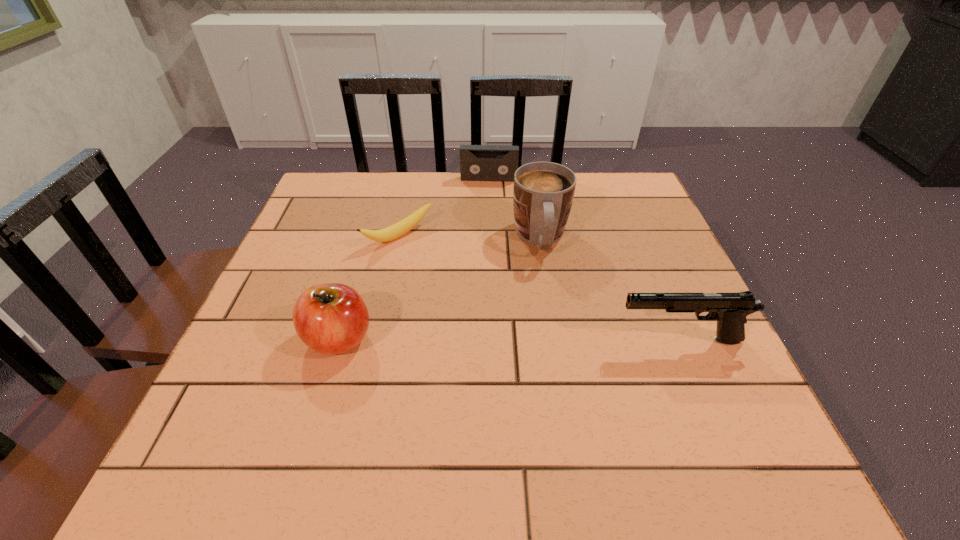
At what (x,y) coordinates should I click in order to perform the action: click on vacant space positioned 0.330m on the upward curve of the shortest object. Please return your answer as a coordinate pair (x, y). Image resolution: width=960 pixels, height=540 pixels. Looking at the image, I should click on (511, 329).

This screenshot has height=540, width=960. Identify the location of vacant space located on the upward curve of the shortest object. (449, 277).

What are the coordinates of `vacant space located on the upward curve of the shortest object` in the screenshot? It's located at (437, 266).

Identify the location of free spot located on the front-facing side of the farthest object. The height and width of the screenshot is (540, 960). (485, 237).

Find the location of a particular element. free space located on the front-facing side of the farthest object is located at coordinates (488, 191).

You are a GUI agent. You are given a task and a screenshot of the screen. Output one action in this format:
    pyautogui.click(x=<x>, y=<y>)
    Task: Click on the free space located 0.400m on the front-facing side of the farthest object
    Image resolution: width=960 pixels, height=540 pixels.
    Given the screenshot: What is the action you would take?
    pyautogui.click(x=483, y=274)

I want to click on free location located 0.180m on the side of the mug with the handle, so click(553, 326).

Where is `vacant space located on the side of the mug with the handle`? Image resolution: width=960 pixels, height=540 pixels. vacant space located on the side of the mug with the handle is located at coordinates (562, 390).

Where is `free spot located on the side of the mug with the handle`? Image resolution: width=960 pixels, height=540 pixels. free spot located on the side of the mug with the handle is located at coordinates (562, 390).

You are a GUI agent. You are given a task and a screenshot of the screen. Output one action in this format:
    pyautogui.click(x=<x>, y=<y>)
    Task: Click on the banana situated at the far edge
    This screenshot has width=960, height=540.
    Given the screenshot: What is the action you would take?
    pyautogui.click(x=390, y=233)